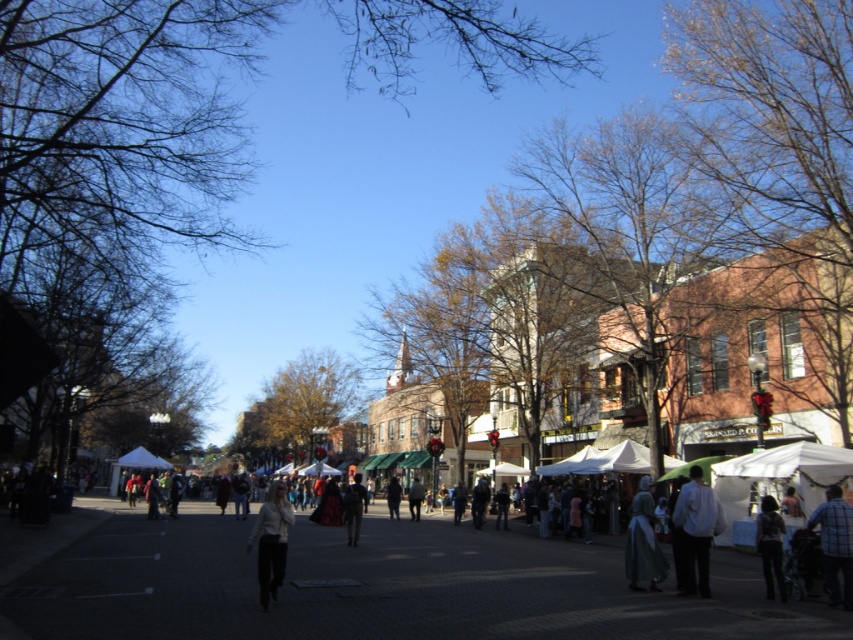
Who is lower down, white matte pants at center or white fabric canopy at center?

Positioned lower is white fabric canopy at center.

The image size is (853, 640). Describe the element at coordinates (271, 540) in the screenshot. I see `white matte pants at center` at that location.

This screenshot has height=640, width=853. What are the coordinates of `white matte pants at center` in the screenshot? It's located at tap(271, 540).

Does white cotton shirt at lower right have a larger size compared to denim jacket at lower right?

Actually, white cotton shirt at lower right might be smaller than denim jacket at lower right.

Between white cotton shirt at lower right and denim jacket at lower right, which one is positioned lower?

white cotton shirt at lower right

Locate an element on the screen. white cotton shirt at lower right is located at coordinates (695, 532).

Does plaid shirt at lower right appear under white matte pants at center?

No, plaid shirt at lower right is not below white matte pants at center.

How much distance is there between plaid shirt at lower right and white matte pants at center?

8.78 meters

Which is in front, point (848, 596) or point (289, 518)?

Positioned in front is point (289, 518).

This screenshot has width=853, height=640. In order to click on plaid shirt at lower right in this screenshot , I will do coord(834,545).